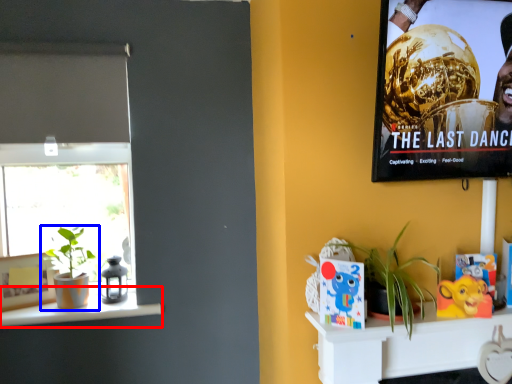
Question: Which object appears farthest to the camera in this image, window sill (highlighted by a red box) or houseplant (highlighted by a blue box)?

Choices:
 (A) window sill
 (B) houseplant

Answer: (B)